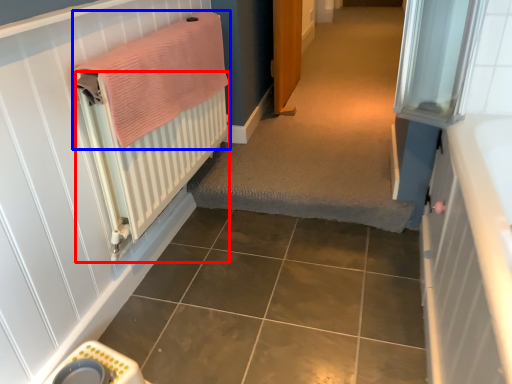
Question: Which object appears closest to the camera in this image, radiator (highlighted by a red box) or bath towel (highlighted by a blue box)?

Choices:
 (A) radiator
 (B) bath towel

Answer: (A)